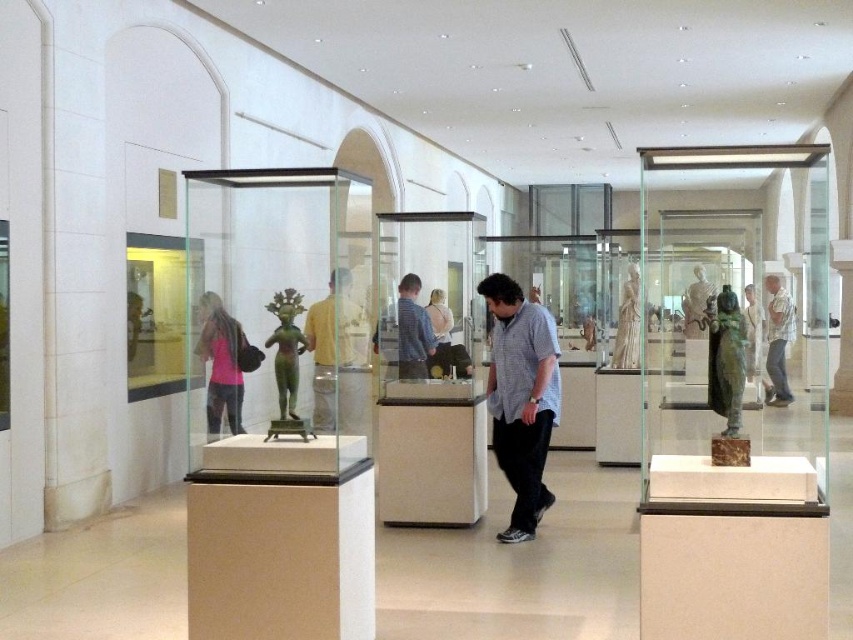
You are a visitor in the museum gallery. You notice a matte yellow shirt at center and a green marble statue at center. Which object is closer to the floor?

The matte yellow shirt at center is positioned under the green marble statue at center, so the matte yellow shirt at center is closer to the floor.